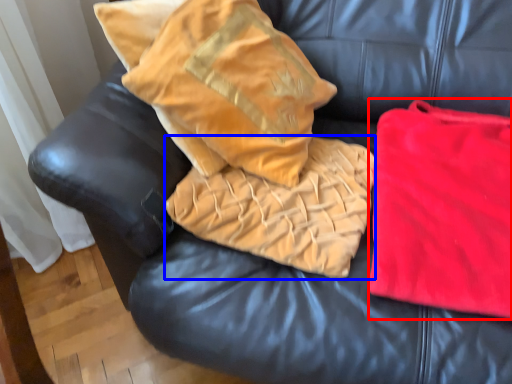
Question: Which of the following is the closest to the observer, material (highlighted by a red box) or cloth (highlighted by a blue box)?

Choices:
 (A) material
 (B) cloth

Answer: (A)